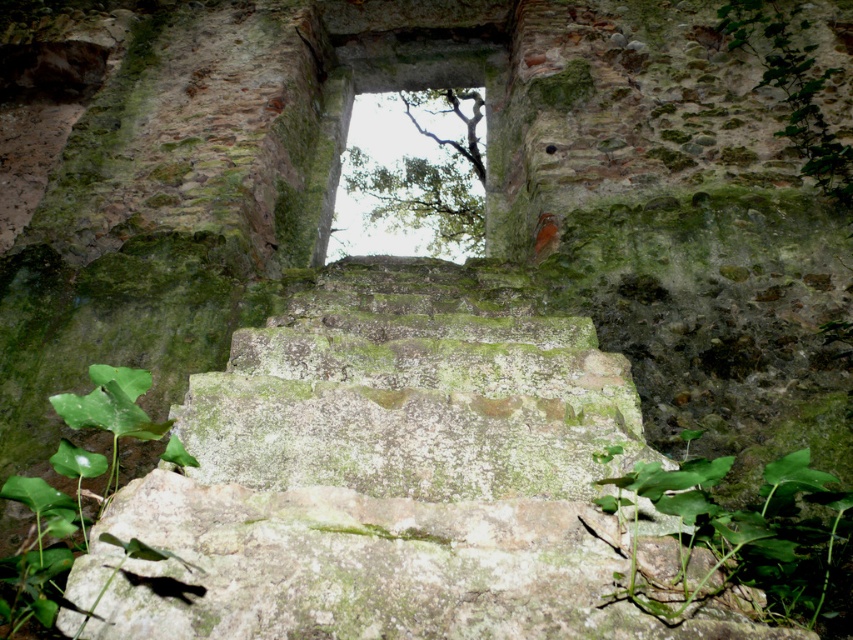
Question: Is green leafy tree at upper center further to the viewer compared to green mossy leaf at upper right?

Choices:
 (A) yes
 (B) no

Answer: (A)

Question: Is green leafy plant at lower right thinner than green leafy plant at lower left?

Choices:
 (A) no
 (B) yes

Answer: (A)

Question: Which point is farther to the camera?

Choices:
 (A) green mossy leaf at upper right
 (B) green leafy plant at lower left
 (C) green leafy plant at lower right
 (D) green leafy tree at upper center

Answer: (D)

Question: Which is farther from the green leafy plant at lower right?

Choices:
 (A) green leafy plant at lower left
 (B) green leafy tree at upper center

Answer: (B)

Question: Is green leafy plant at lower right bigger than green mossy leaf at upper right?

Choices:
 (A) yes
 (B) no

Answer: (B)

Question: Among these objects, which one is nearest to the camera?

Choices:
 (A) green leafy plant at lower left
 (B) green leafy tree at upper center
 (C) green leafy plant at lower right
 (D) green mossy leaf at upper right

Answer: (A)